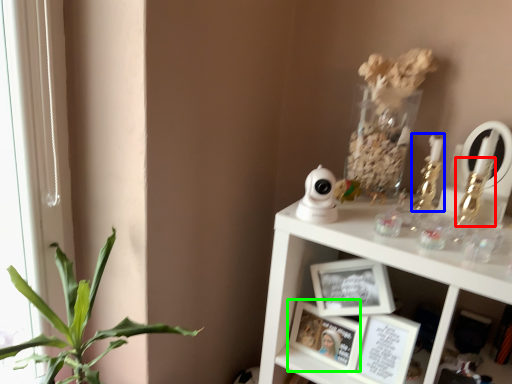
Question: Which object is the closest to the toy (highlighted by a red box)? Choose among these: candle holder (highlighted by a blue box) or picture frame (highlighted by a green box).

Choices:
 (A) candle holder
 (B) picture frame

Answer: (A)